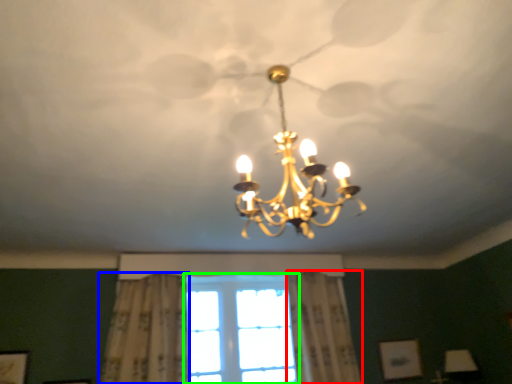
Question: Which object is the closest to the curtain (highlighted by a red box)? Choose among these: curtain (highlighted by a blue box) or window (highlighted by a green box).

Choices:
 (A) curtain
 (B) window

Answer: (B)